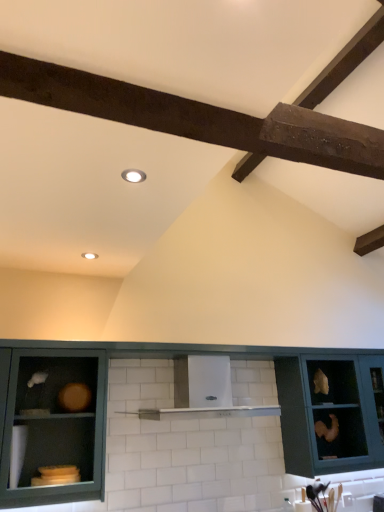
Question: Would you say white glossy vent at center is to the left or to the right of matte teal cabinet at center, placed as the 2th cabinetry when sorted from right to left, in the picture?

Choices:
 (A) left
 (B) right

Answer: (A)

Question: Considering their positions, is white glossy vent at center located in front of or behind matte teal cabinet at center, the 2th cabinetry in the left-to-right sequence?

Choices:
 (A) front
 (B) behind

Answer: (B)

Question: Which object is positioned closest to the matte green cabinet at lower left, positioned as the third cabinetry in right-to-left order?

Choices:
 (A) matte teal cabinet at right, the third cabinetry in the left-to-right sequence
 (B) matte teal cabinet at center, the 2th cabinetry in the left-to-right sequence
 (C) white glossy vent at center

Answer: (B)

Question: Which is farther from the matte teal cabinet at center, placed as the 2th cabinetry when sorted from right to left?

Choices:
 (A) matte teal cabinet at right, the third cabinetry in the left-to-right sequence
 (B) matte green cabinet at lower left, acting as the 1th cabinetry starting from the left
 (C) white glossy vent at center

Answer: (A)